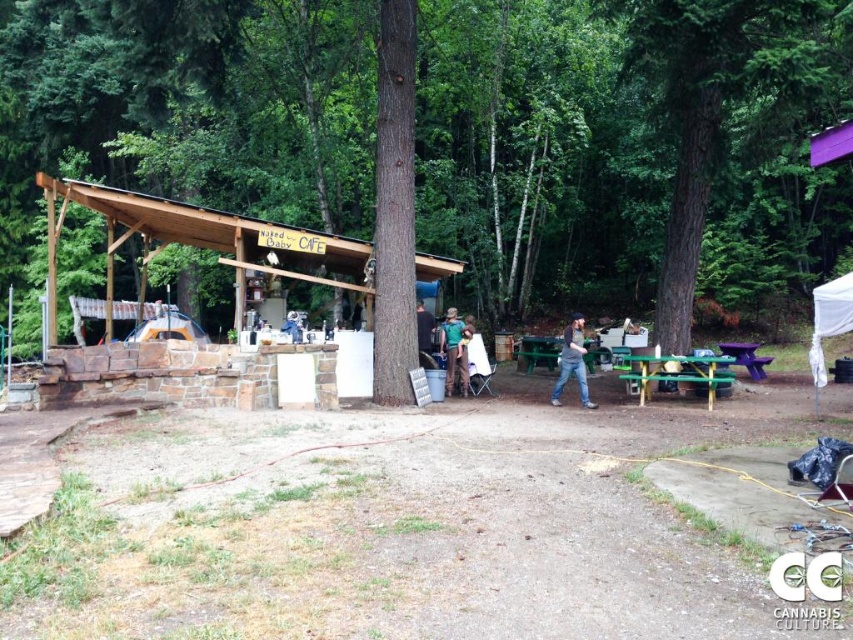
Is the position of brown wood tree at center less distant than that of green fabric shirt at center?

Yes, it is in front of green fabric shirt at center.

Does brown wood tree at center lie behind green fabric shirt at center?

No.

From the picture: Who is more distant from viewer, (538, 291) or (447, 388)?

Positioned behind is point (538, 291).

Image resolution: width=853 pixels, height=640 pixels. In order to click on brown wood tree at center in this screenshot , I will do `click(630, 150)`.

Does white fabric tent at right have a larger size compared to green plastic picnic table at lower right?

Yes, white fabric tent at right is bigger than green plastic picnic table at lower right.

Is point (834, 317) farther from camera compared to point (746, 342)?

No.

Does point (836, 324) lie in front of point (730, 355)?

Yes, it is.

What are the coordinates of `white fabric tent at right` in the screenshot? It's located at (828, 324).

Is green rough bark tree at center thinner than green fabric shirt at center?

Incorrect, green rough bark tree at center's width is not less than green fabric shirt at center's.

Can you confirm if green rough bark tree at center is bigger than green fabric shirt at center?

Incorrect, green rough bark tree at center is not larger than green fabric shirt at center.

Which is in front, point (804, 70) or point (465, 392)?

Point (804, 70) is in front.

Image resolution: width=853 pixels, height=640 pixels. What are the coordinates of `green rough bark tree at center` in the screenshot? It's located at (711, 106).